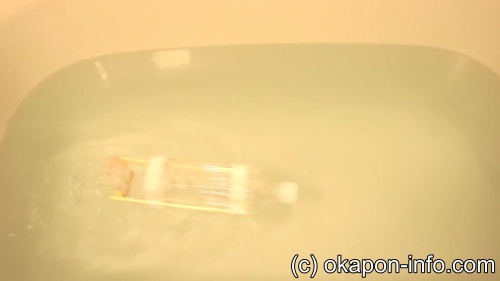
Find the location of a particular element. The width and height of the screenshot is (500, 281). bath basin is located at coordinates (16, 57).